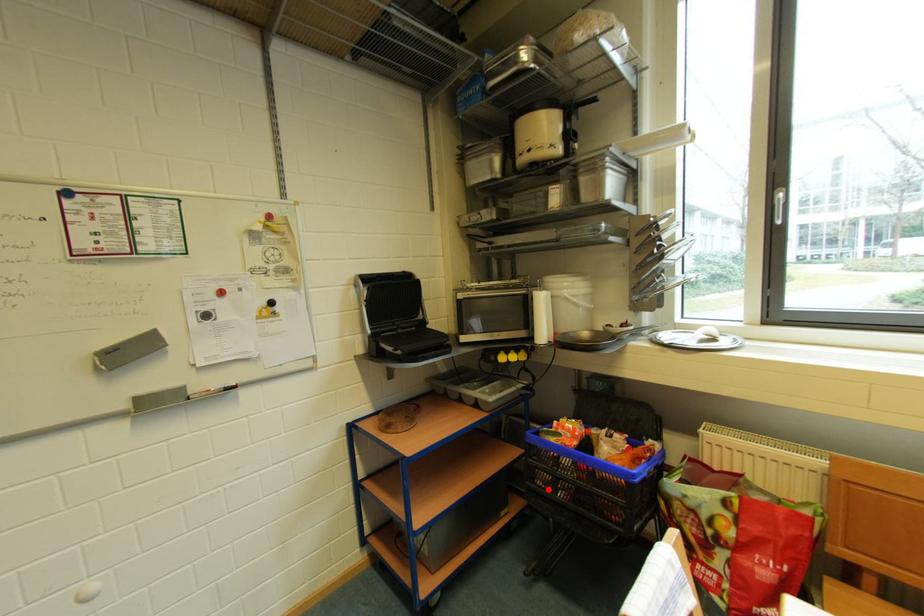
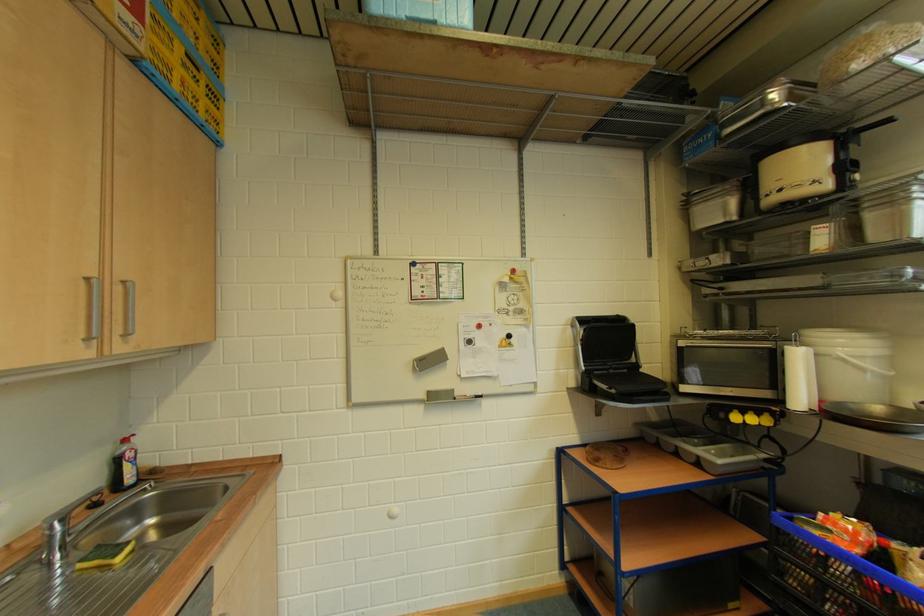
Question: A red point is marked in image1. In image2, is the corresponding 3D point closer to the camera or farther? Reply with the corresponding letter.

Choices:
 (A) The corresponding 3D point is closer.
 (B) The corresponding 3D point is farther.

Answer: (B)